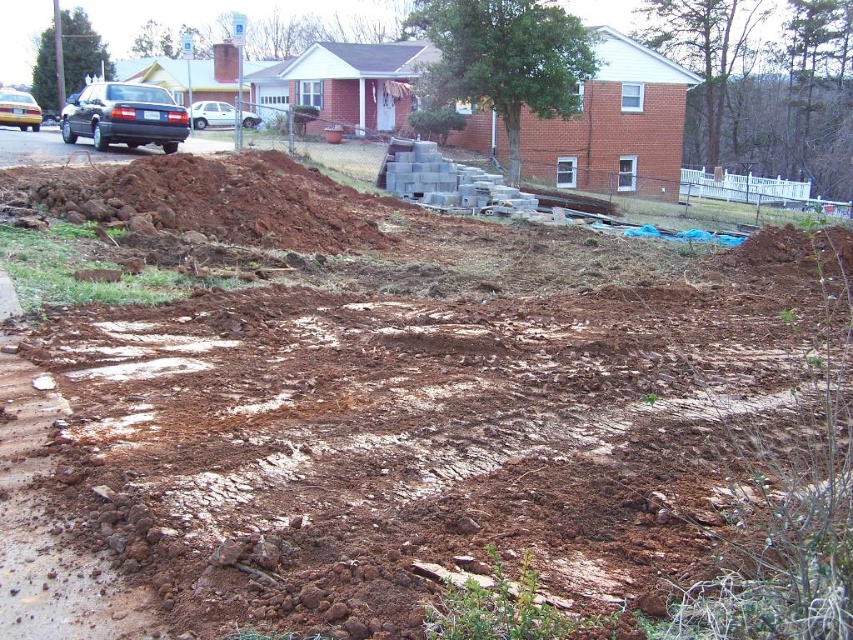
You are a delivery driver who needs to park your truck between the matte blue sedan at left and the matte black car at left. The truck requires a minimum height clearance of 2 meters. Can you safely park there based on the vehicles heights?

The matte blue sedan at left has a lesser height compared to matte black car at left. However, without knowing the exact height of either vehicle, it is impossible to determine if the 2 meter clearance requirement is met. You should measure the height of the tallest vehicle present before deciding.

You are a delivery driver approaching the residential area and need to park your truck. You see a brown dirt mound at left and a matte blue sedan at left. Which object is closer to you as you enter the area?

The brown dirt mound at left is closer to the viewer than the matte blue sedan at left, so the dirt mound would be the first object encountered upon entering the area.